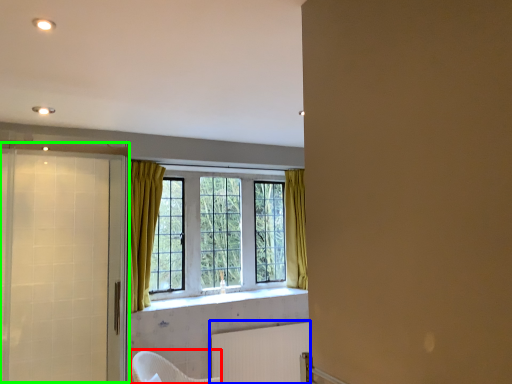
Question: Based on their relative distances, which object is nearer to armchair (highlighted by a red box)? Choose from radiator (highlighted by a blue box) and screen door (highlighted by a green box).

Choices:
 (A) radiator
 (B) screen door

Answer: (A)